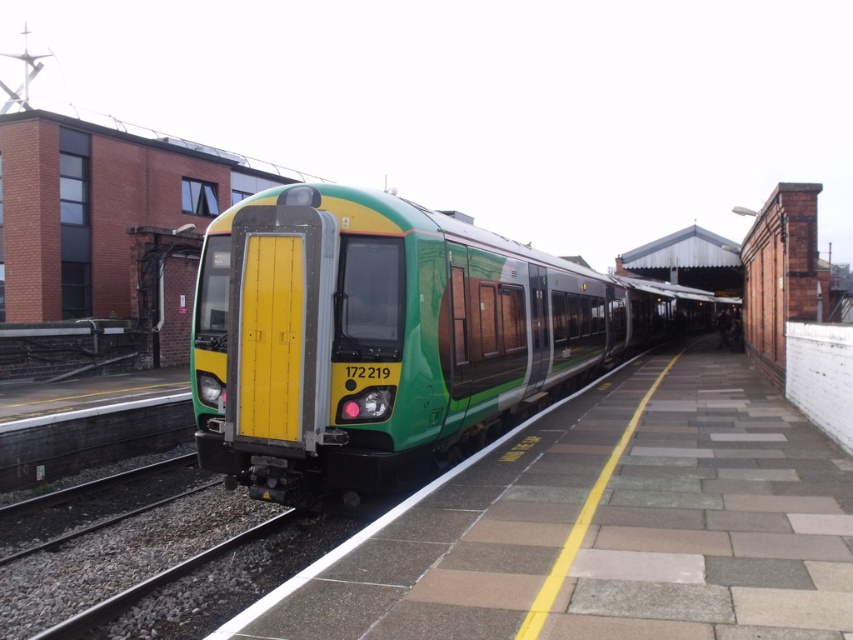
You are a maintenance worker needing to inspect the gap between the train and the green matte platform at center. According to safety regulations, the maximum allowable gap is 3.5 meters. Is the gap within the safe limit?

The gap between the train and the green matte platform at center is 3.76 meters, which exceeds the maximum allowable gap of 3.5 meters. Therefore, the gap is not within the safe limit.

You are a passenger waiting on the green matte platform at center. You see the green matte train at center approaching. Will you be able to safely board the train before it departs if you start walking towards the nearest entrance immediately?

The green matte platform at center and green matte train at center are 22.16 feet apart. Since the distance between them is significant, you should be able to board the train safely before it departs as long as you move promptly.

You are a passenger waiting at the train station. You see the green matte platform at center and the green matte train at center. Which one is closer to you?

The green matte platform at center is closer to you because it is in front of the green matte train at center.